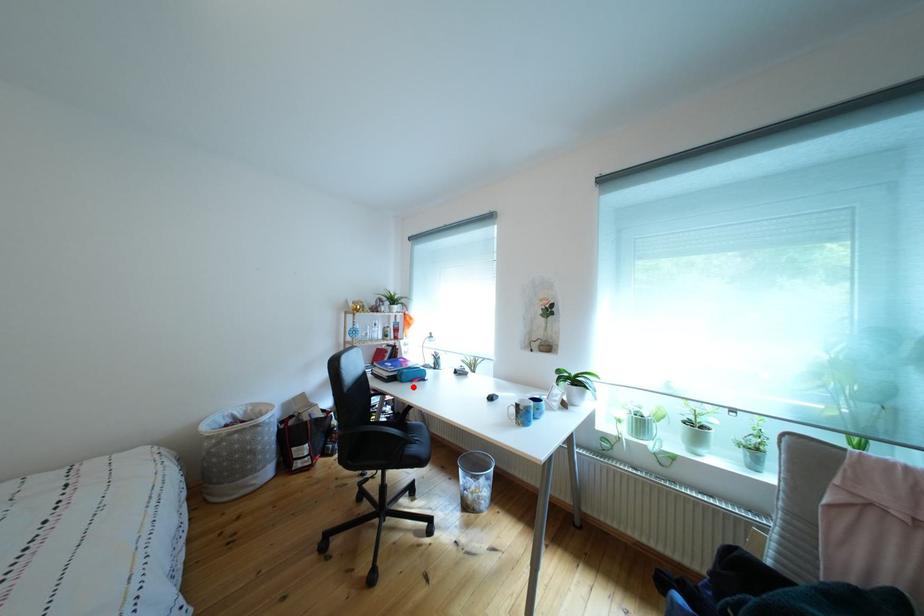
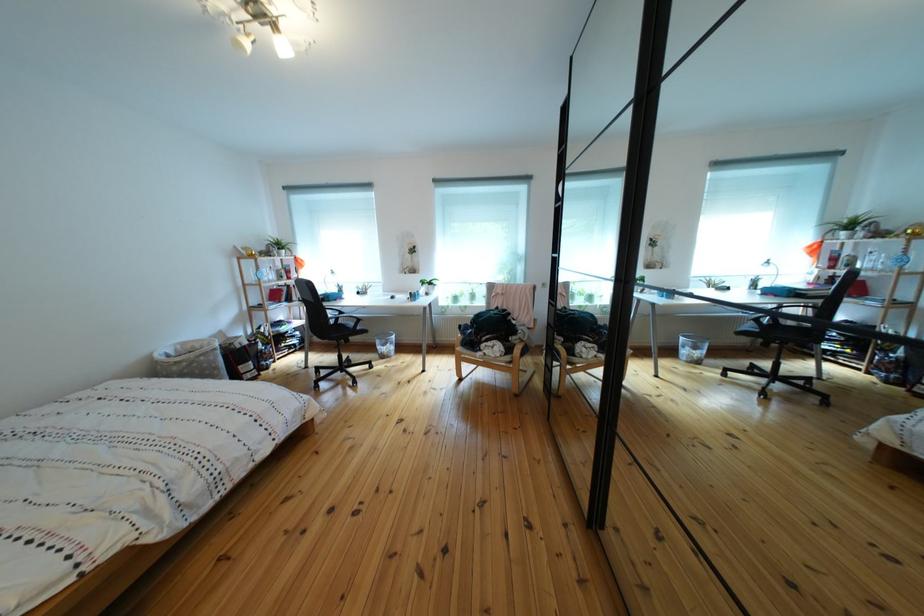
Question: I am providing you with two images of the same scene from different viewpoints. Given a red point in image1, look at the same physical point in image2. Is it:

Choices:
 (A) Closer to the viewpoint
 (B) Farther from the viewpoint

Answer: (A)